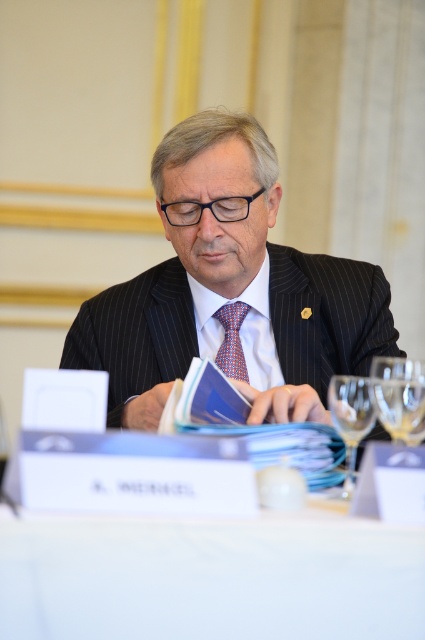
Question: Which object is closer to the camera taking this photo?

Choices:
 (A) white fabric table at center
 (B) pinstriped suit at center

Answer: (A)

Question: Observing the image, what is the correct spatial positioning of pinstriped suit at center in reference to white fabric table at center?

Choices:
 (A) right
 (B) left

Answer: (A)

Question: Does pinstriped suit at center appear on the right side of multicolored woven tie at center?

Choices:
 (A) no
 (B) yes

Answer: (A)

Question: Which object is the farthest from the transparent glass at lower right?

Choices:
 (A) multicolored woven tie at center
 (B) pinstriped suit at center
 (C) transparent glass at right
 (D) white fabric table at center

Answer: (A)

Question: Which point is closer to the camera taking this photo?

Choices:
 (A) (337, 410)
 (B) (218, 353)
 (C) (411, 388)
 (D) (124, 531)

Answer: (D)

Question: Can you confirm if pinstriped suit at center is thinner than transparent glass at lower right?

Choices:
 (A) yes
 (B) no

Answer: (B)